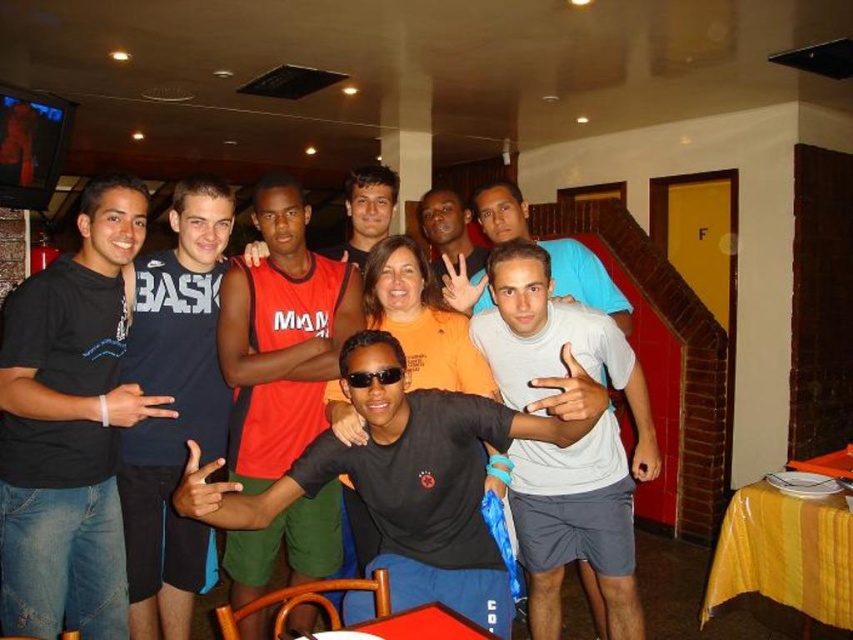
Question: Can you confirm if black cotton t-shirt at left is smaller than red jersey at center?

Choices:
 (A) yes
 (B) no

Answer: (B)

Question: Does red jersey at center appear under black cotton t-shirt at center?

Choices:
 (A) no
 (B) yes

Answer: (B)

Question: Which point is closer to the camera?

Choices:
 (A) (283, 515)
 (B) (120, 496)

Answer: (B)

Question: Which point is closer to the camera?

Choices:
 (A) (51, 627)
 (B) (392, 512)

Answer: (B)

Question: In this image, where is black cotton t-shirt at center located relative to matte orange shirt at center?

Choices:
 (A) right
 (B) left

Answer: (B)

Question: Which object is positioned closest to the red jersey at center?

Choices:
 (A) black cotton t-shirt at left
 (B) matte orange shirt at center

Answer: (A)